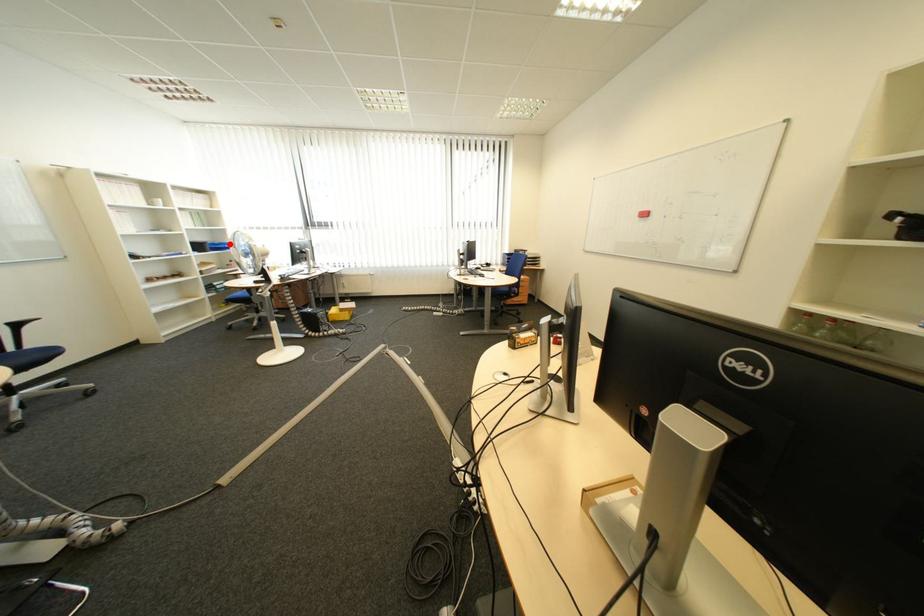
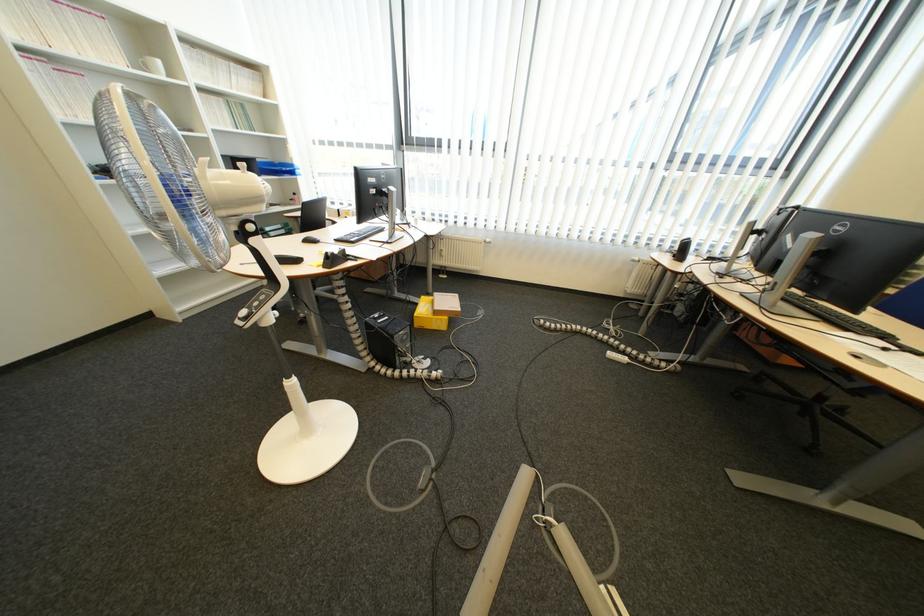
Question: I am providing you with two images of the same scene from different viewpoints. Image1 has a red point marked. In image2, the corresponding 3D location appears at what relative position? Reply with the corresponding letter.

Choices:
 (A) Closer
 (B) Farther

Answer: (A)